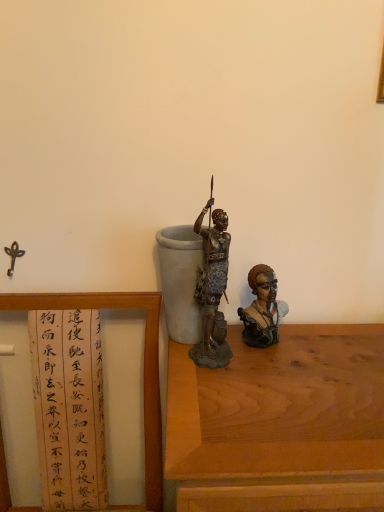
The width and height of the screenshot is (384, 512). Find the location of `vacant space to the right of matte brown bust at right, which is counted as the 1th person, starting from the right`. vacant space to the right of matte brown bust at right, which is counted as the 1th person, starting from the right is located at coordinates (332, 343).